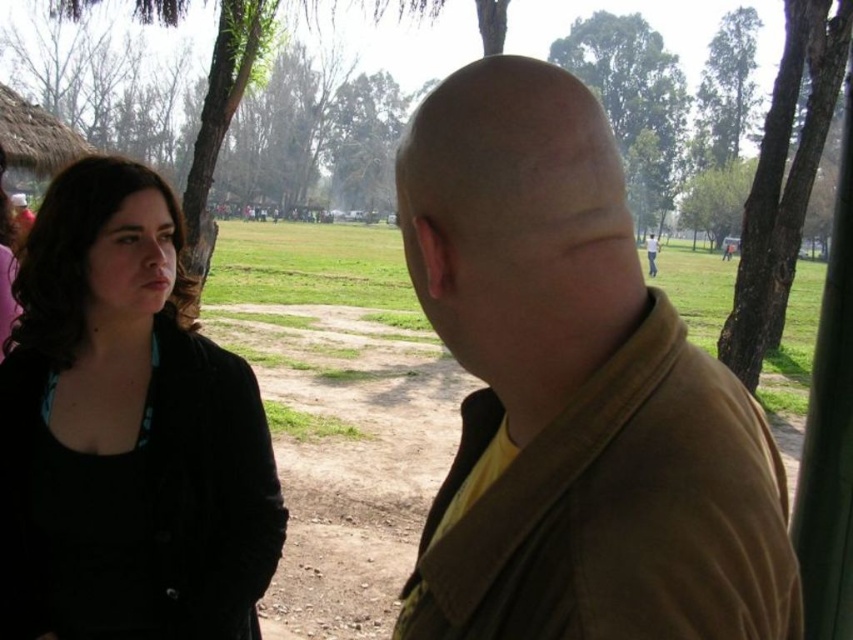
Does brown matte jacket at center have a lesser height compared to black matte jacket at left?

Correct, brown matte jacket at center is not as tall as black matte jacket at left.

Is point (645, 516) behind point (257, 468)?

No, it is not.

Is point (616, 552) farther from viewer compared to point (67, 180)?

No.

The width and height of the screenshot is (853, 640). I want to click on brown matte jacket at center, so click(x=573, y=394).